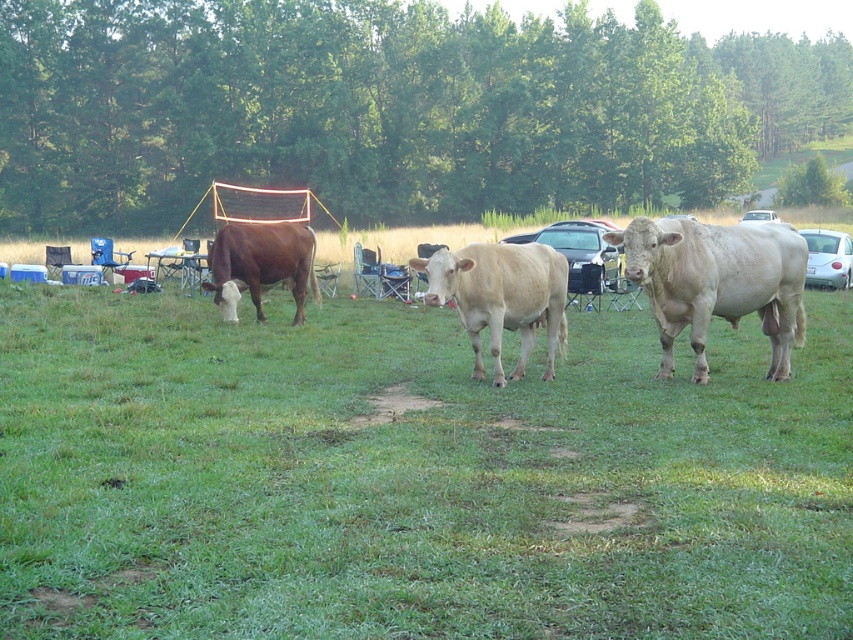
You are a farmer who wants to separate the light beige smooth cow at center and the brown matte cow at center using a fence. The fence you have can be placed anywhere but must be a straight line. What is the minimum length of the fence required to completely separate them?

The minimum length of the fence required to completely separate the light beige smooth cow at center and the brown matte cow at center is 13.92 feet, as this distance is the shortest straight line that can separate them.

You are standing at the center of the image and want to locate the white smooth bull at right. Based on the coordinates provided, in which direction should you look to find it?

The white smooth bull at right is located at coordinates point (717, 282), which is to the right side of the image. Since you are at the center, you should look to your right to find it.

You are a photographer trying to capture a photo of the light beige smooth cow at center and the brown matte cow at center. Since you want both cows in the frame, which cow should you focus on first to ensure both are in the shot?

The light beige smooth cow at center is located below the brown matte cow at center. To include both in the frame, focus on the brown matte cow at center first as it is higher up, then adjust the camera angle to include the lower positioned light beige smooth cow at center.